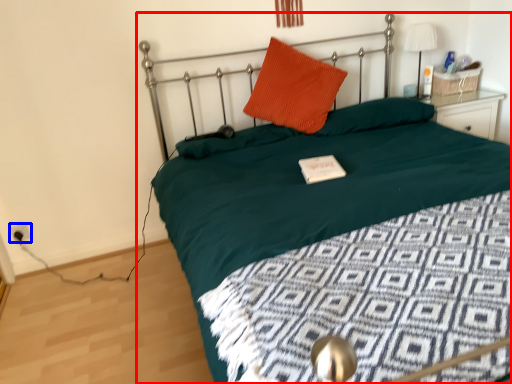
Question: Among these objects, which one is nearest to the camera, bed (highlighted by a red box) or electric outlet (highlighted by a blue box)?

Choices:
 (A) bed
 (B) electric outlet

Answer: (A)